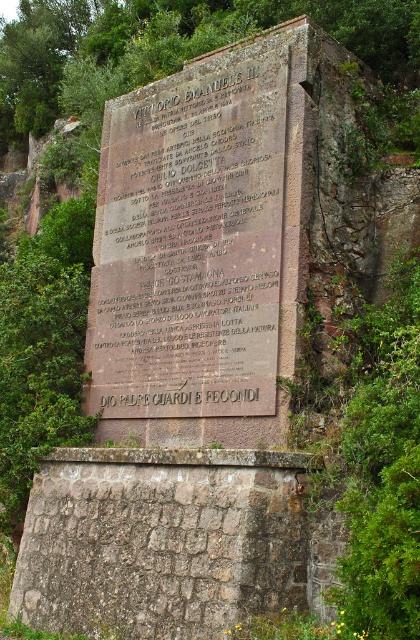
The image size is (420, 640). What do you see at coordinates (193, 248) in the screenshot? I see `dark brown stone plaque at center` at bounding box center [193, 248].

Which is behind, point (139, 275) or point (231, 531)?

The point (139, 275) is behind.

Between point (270, 125) and point (160, 582), which one is positioned behind?

The point (270, 125) is behind.

Locate an element on the screen. dark brown stone plaque at center is located at coordinates (193, 248).